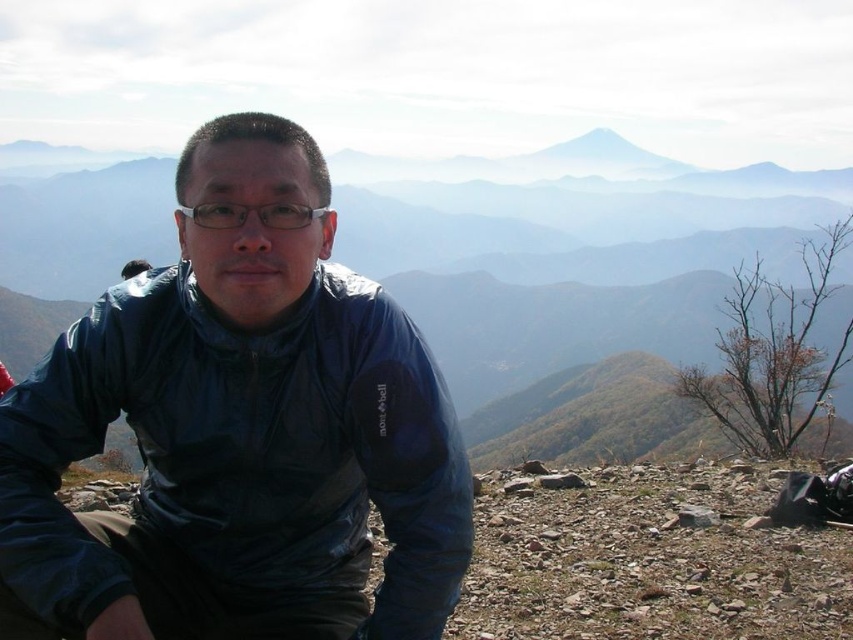
Which of these two, matte blue jacket at center or transparent plastic glasses at center, stands shorter?

transparent plastic glasses at center is shorter.

The width and height of the screenshot is (853, 640). Identify the location of matte blue jacket at center. (236, 456).

Where is `matte blue jacket at center`? The image size is (853, 640). matte blue jacket at center is located at coordinates (236, 456).